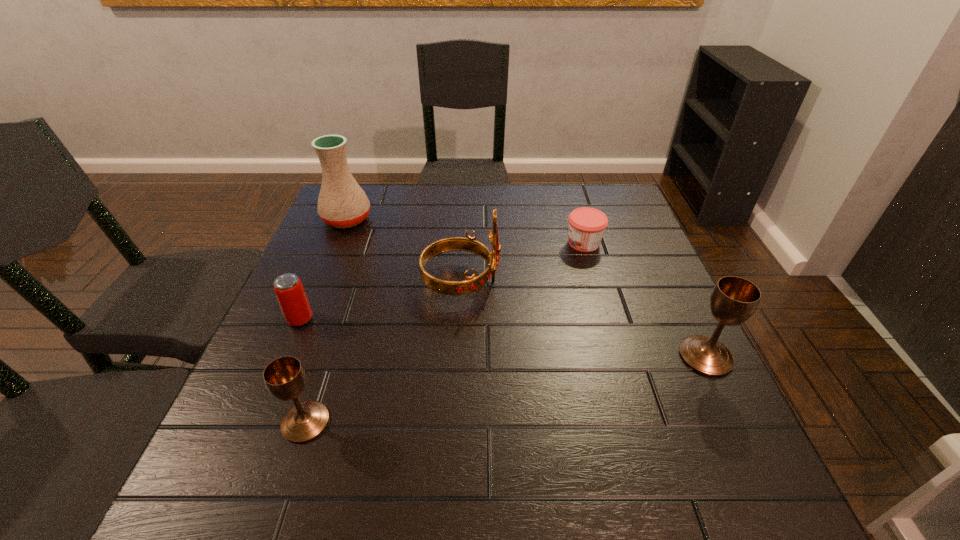
Locate an element on the screen. This screenshot has width=960, height=540. the shorter chalice is located at coordinates (285, 378).

Locate an element on the screen. The image size is (960, 540). the fourth tallest object is located at coordinates (285, 378).

At what (x,y) coordinates should I click in order to perform the action: click on the second nearest object. Please return your answer as a coordinate pair (x, y). Looking at the image, I should click on (733, 300).

At what (x,y) coordinates should I click in order to perform the action: click on the farther chalice. Please return your answer as a coordinate pair (x, y). Looking at the image, I should click on (733, 300).

Where is `the fourth object from left to right`? the fourth object from left to right is located at coordinates (471, 284).

Find the location of a particular element. The width and height of the screenshot is (960, 540). the third farthest object is located at coordinates tap(471, 284).

Image resolution: width=960 pixels, height=540 pixels. I want to click on the fifth object from left to right, so click(587, 225).

Find the location of a particular element. jam is located at coordinates (587, 225).

Identify the location of pottery. (342, 203).

You are a GUI agent. You are given a task and a screenshot of the screen. Output one action in this format:
    pyautogui.click(x=<x>, y=<y>)
    Task: Click on the fifth tallest object
    This screenshot has width=960, height=540.
    Given the screenshot: What is the action you would take?
    pyautogui.click(x=288, y=288)